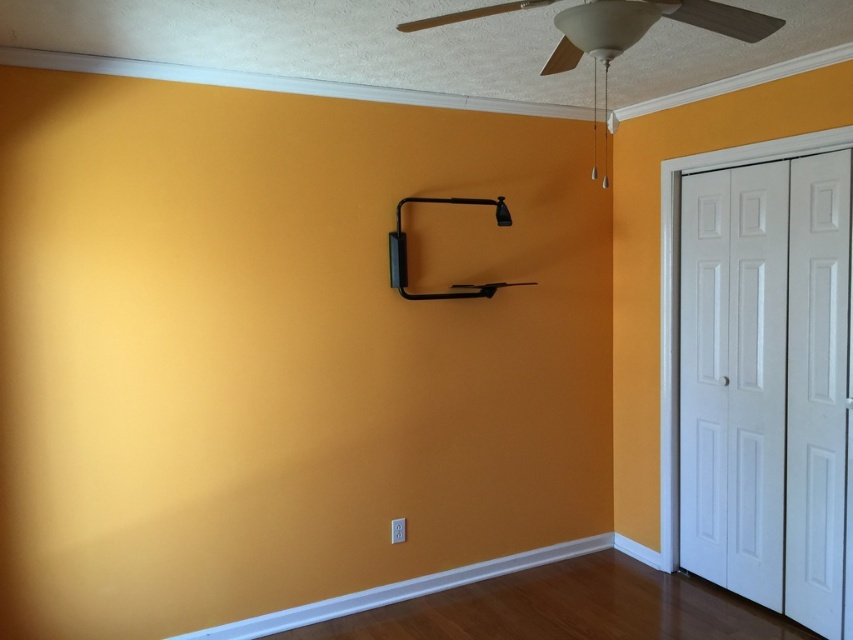
Who is higher up, white matte ceiling fan at upper center or white smooth baseboard at lower center?

white matte ceiling fan at upper center is above.

Where is `white matte ceiling fan at upper center`? The image size is (853, 640). white matte ceiling fan at upper center is located at coordinates (679, 19).

You are a GUI agent. You are given a task and a screenshot of the screen. Output one action in this format:
    pyautogui.click(x=<x>, y=<y>)
    Task: Click on the white matte ceiling fan at upper center
    
    Given the screenshot: What is the action you would take?
    pyautogui.click(x=679, y=19)

Between white smooth baseboard at lower center and black matte/finish bookshelf at upper center, which one is positioned higher?

black matte/finish bookshelf at upper center

Is white smooth baseboard at lower center above black matte/finish bookshelf at upper center?

Incorrect, white smooth baseboard at lower center is not positioned above black matte/finish bookshelf at upper center.

Locate an element on the screen. This screenshot has width=853, height=640. white smooth baseboard at lower center is located at coordinates (398, 589).

From the picture: Which is more to the left, white matte ceiling fan at upper center or black matte/finish bookshelf at upper center?

Positioned to the left is black matte/finish bookshelf at upper center.

Can you confirm if white matte ceiling fan at upper center is shorter than black matte/finish bookshelf at upper center?

Yes.

Measure the distance between point (x=668, y=0) and camera.

Point (x=668, y=0) and camera are 5.82 feet apart.

The height and width of the screenshot is (640, 853). Identify the location of white matte ceiling fan at upper center. (679, 19).